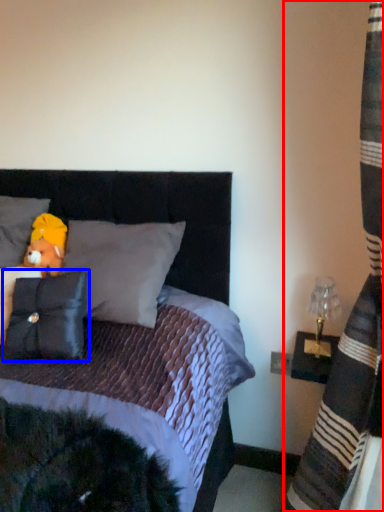
Question: Among these objects, which one is farthest to the camera, curtain (highlighted by a red box) or pillow (highlighted by a blue box)?

Choices:
 (A) curtain
 (B) pillow

Answer: (B)